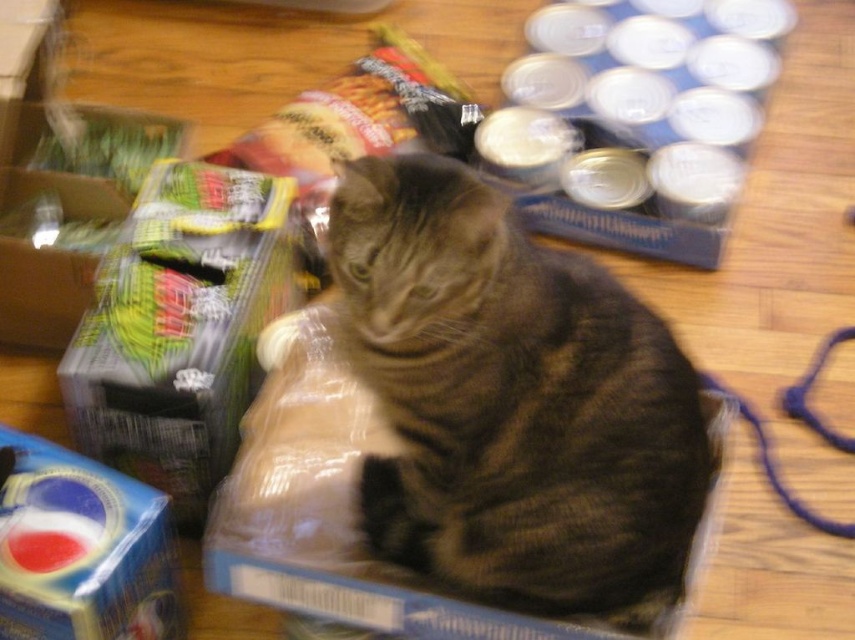
You are a delivery person who needs to place a package at point (390, 321). The package is 1 meter long. Can you place it horizontally without overlapping any existing items?

The distance from the camera to point (390, 321) is 87.46 centimeters. Since the package is 1 meter long, placing it horizontally would require more space than available, so it cannot be placed without overlapping existing items.

You are standing at the point marked as point (171, 243) in the image. You want to move to the cat sitting on the cardboard box. Can you reach the cat without moving your feet?

The point (171, 243) is 4.76 feet away from the viewer. Since you are standing at that point, you can reach the cat sitting on the cardboard box without moving your feet if the distance is within your reach. However, the description only provides the distance between the point and the viewer, not the cat. Therefore, it is unclear if the cat is within reach.